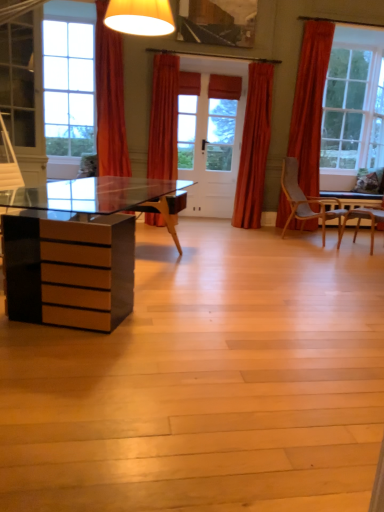
Question: From a real-world perspective, relative to orange fabric curtain at upper center, which ranks as the 3th curtain in right-to-left order, is orange fabric curtain at center, the second curtain from the right, vertically above or below?

Choices:
 (A) above
 (B) below

Answer: (B)

Question: In the image, is orange fabric curtain at center, which ranks as the second curtain in left-to-right order, positioned in front of or behind orange fabric curtain at upper center, which ranks as the 3th curtain in right-to-left order?

Choices:
 (A) front
 (B) behind

Answer: (B)

Question: Based on their relative distances, which object is farther from the orange fabric curtain at center, the second curtain from the right?

Choices:
 (A) velvet orange curtain at center, which is counted as the third curtain, starting from the left
 (B) orange fabric curtain at upper center, which ranks as the 3th curtain in right-to-left order

Answer: (A)

Question: Which is nearer to the velvet orange curtain at center, the 1th curtain when ordered from right to left?

Choices:
 (A) orange fabric curtain at center, which ranks as the second curtain in left-to-right order
 (B) orange fabric curtain at upper center, the 1th curtain in the left-to-right sequence

Answer: (A)